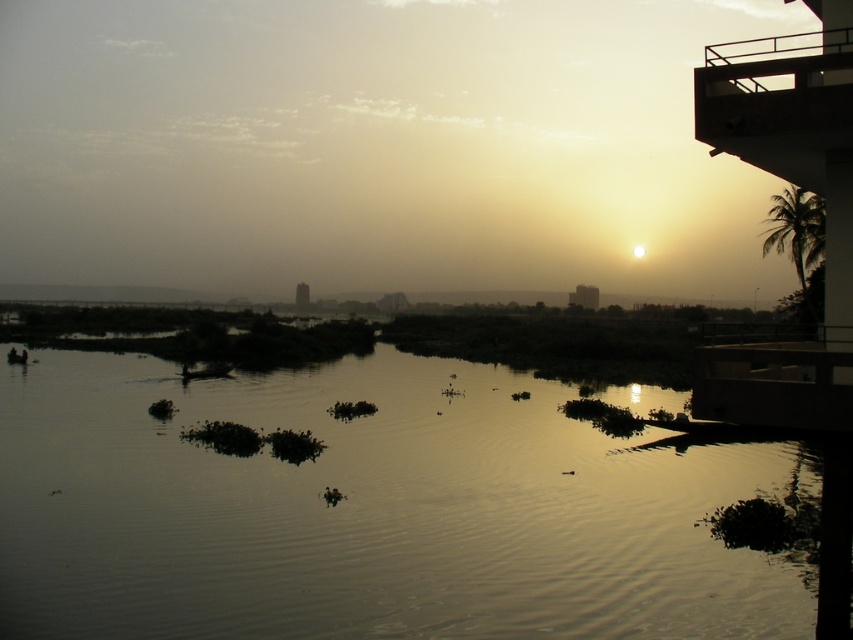
You are standing at the edge of the water and want to locate the silvery reflective water at center. According to the coordinates provided, in which direction should you look relative to your position?

The silvery reflective water at center is located at coordinates point (x=370, y=509). Since the x coordinate is 0.798, which is closer to 1, it is positioned to the right side. The y coordinate 0.436 is closer to 0.5, so it is near the center vertically. Therefore, you should look to the right and slightly downward from the center of your view to locate it.

You are an architect designing a new building and want to ensure that the metallic balcony at upper right doesn not block the view of the silvery reflective water at center from the living room. Based on the scene, which object takes up more space in the image?

The metallic balcony at upper right takes up more space in the image than the silvery reflective water at center, so it might block the view.